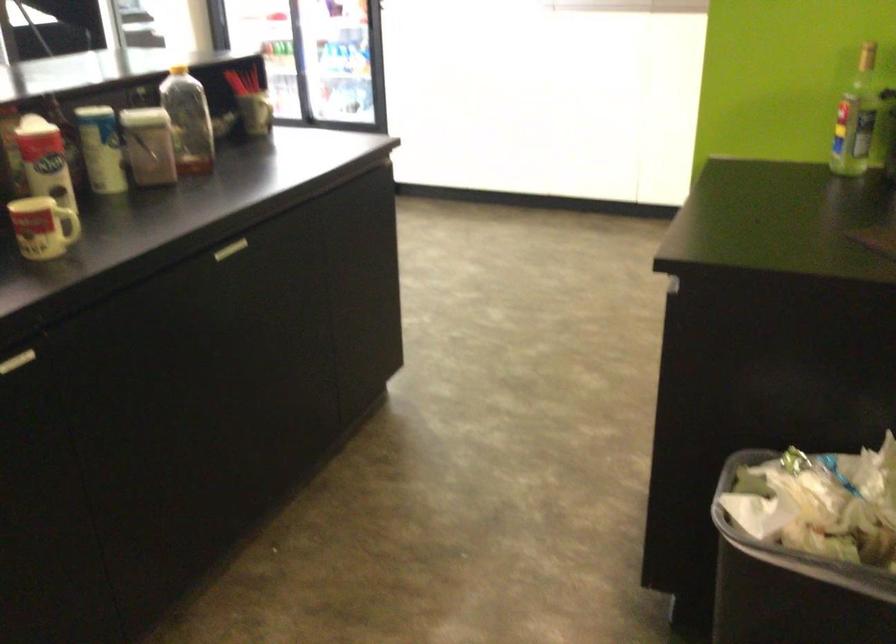
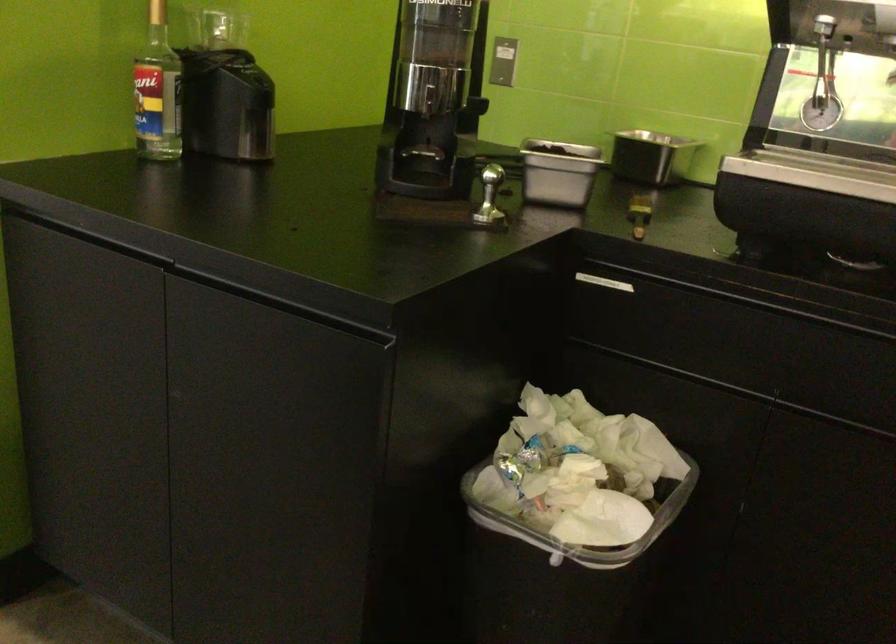
The point at (821, 106) is marked in the first image. Where is the corresponding point in the second image?

(158, 91)